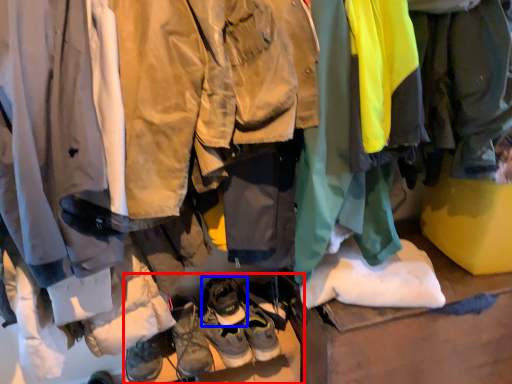
Question: Which object appears closest to the camera in this image, footwear (highlighted by a red box) or footwear (highlighted by a blue box)?

Choices:
 (A) footwear
 (B) footwear

Answer: (B)